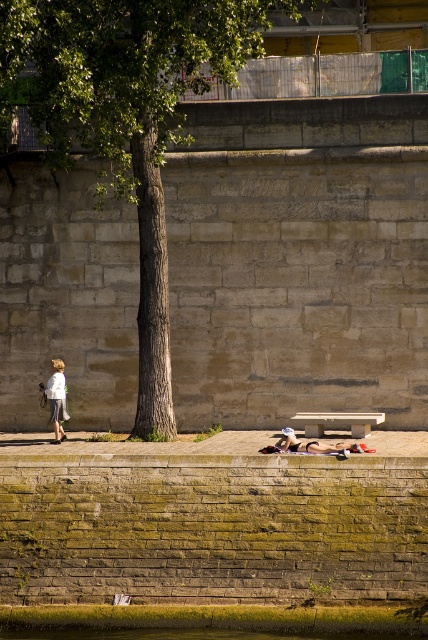
Question: Where is green leafy tree at center located in relation to white cotton shirt at left in the image?

Choices:
 (A) above
 (B) below

Answer: (A)

Question: Can you confirm if green leafy tree at center is positioned below white cotton shirt at left?

Choices:
 (A) yes
 (B) no

Answer: (B)

Question: Which of the following is the closest to the observer?

Choices:
 (A) (342, 419)
 (B) (305, 637)

Answer: (B)

Question: Does green water at lower left have a larger size compared to tan leather sandals at lower center?

Choices:
 (A) yes
 (B) no

Answer: (A)

Question: Among these objects, which one is nearest to the camera?

Choices:
 (A) stone bench at lower center
 (B) green leafy tree at center
 (C) tan leather sandals at lower center
 (D) white cotton shirt at left

Answer: (B)

Question: Among these points, which one is farthest from the camera?

Choices:
 (A) (338, 444)
 (B) (101, 634)

Answer: (A)